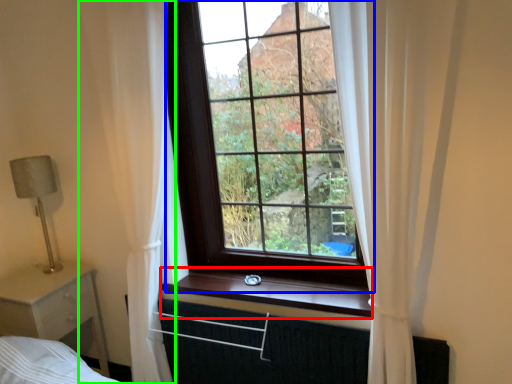
Question: Estimate the real-world distances between objects in this image. Which object is closer to window sill (highlighted by a red box), window (highlighted by a blue box) or curtain (highlighted by a green box)?

Choices:
 (A) window
 (B) curtain

Answer: (A)